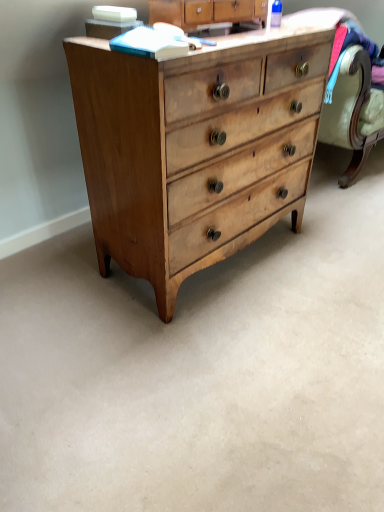
Question: From a real-world perspective, is light brown wood chest of drawers at center positioned above or below light brown wood dresser at upper center?

Choices:
 (A) below
 (B) above

Answer: (A)

Question: Is light brown wood chest of drawers at center inside or outside of light brown wood dresser at upper center?

Choices:
 (A) inside
 (B) outside

Answer: (B)

Question: Is light brown wood chest of drawers at center to the left or to the right of light brown wood dresser at upper center in the image?

Choices:
 (A) right
 (B) left

Answer: (B)

Question: Considering the positions of light brown wood dresser at upper center and light brown wood chest of drawers at center in the image, is light brown wood dresser at upper center bigger or smaller than light brown wood chest of drawers at center?

Choices:
 (A) big
 (B) small

Answer: (B)

Question: From their relative heights in the image, would you say light brown wood dresser at upper center is taller or shorter than light brown wood chest of drawers at center?

Choices:
 (A) short
 (B) tall

Answer: (A)

Question: From a real-world perspective, is light brown wood dresser at upper center positioned above or below light brown wood chest of drawers at center?

Choices:
 (A) above
 (B) below

Answer: (A)

Question: Relative to light brown wood chest of drawers at center, is light brown wood dresser at upper center in front or behind?

Choices:
 (A) behind
 (B) front

Answer: (A)